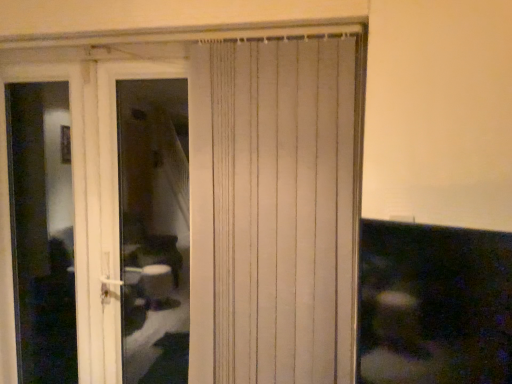
Question: Could you tell me if white plastic door at left is facing transparent glass screen door at left?

Choices:
 (A) yes
 (B) no

Answer: (B)

Question: Is white plastic door at left closer to camera compared to transparent glass screen door at left?

Choices:
 (A) no
 (B) yes

Answer: (B)

Question: Could transparent glass screen door at left be considered to be inside white plastic door at left?

Choices:
 (A) no
 (B) yes

Answer: (A)

Question: Is white plastic door at left facing away from transparent glass screen door at left?

Choices:
 (A) no
 (B) yes

Answer: (A)

Question: From a real-world perspective, is white plastic door at left positioned under transparent glass screen door at left based on gravity?

Choices:
 (A) yes
 (B) no

Answer: (B)

Question: Is transparent glass screen door at left in front of or behind white textured curtain at center in the image?

Choices:
 (A) behind
 (B) front

Answer: (A)

Question: Looking at the image, does transparent glass screen door at left seem bigger or smaller compared to white textured curtain at center?

Choices:
 (A) big
 (B) small

Answer: (B)

Question: Considering the positions of transparent glass screen door at left and white textured curtain at center in the image, is transparent glass screen door at left taller or shorter than white textured curtain at center?

Choices:
 (A) short
 (B) tall

Answer: (B)

Question: From the image's perspective, relative to white textured curtain at center, is transparent glass screen door at left above or below?

Choices:
 (A) below
 (B) above

Answer: (A)

Question: From a real-world perspective, is white textured curtain at center physically located above or below white plastic door at left?

Choices:
 (A) below
 (B) above

Answer: (B)

Question: In the image, is white textured curtain at center on the left side or the right side of white plastic door at left?

Choices:
 (A) left
 (B) right

Answer: (B)

Question: Choose the correct answer: Is white textured curtain at center inside white plastic door at left or outside it?

Choices:
 (A) inside
 (B) outside

Answer: (B)

Question: Is point (294, 180) positioned closer to the camera than point (159, 251)?

Choices:
 (A) farther
 (B) closer

Answer: (B)

Question: From the image's perspective, is transparent glass screen door at left located above or below white plastic door at left?

Choices:
 (A) above
 (B) below

Answer: (B)

Question: Visually, is transparent glass screen door at left positioned to the left or to the right of white plastic door at left?

Choices:
 (A) left
 (B) right

Answer: (A)